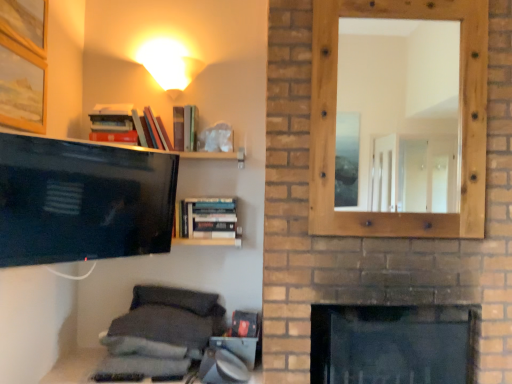
What do you see at coordinates (177, 299) in the screenshot? I see `dark gray fabric pillow at lower center, arranged as the first pillow when viewed from the top` at bounding box center [177, 299].

How much space does wooden picture frame at upper left, arranged as the second picture frame when ordered from the bottom, occupy vertically?

It is 11.12 inches.

The image size is (512, 384). What are the coordinates of `hardcover books at center` in the screenshot? It's located at (206, 218).

Describe the element at coordinates (169, 65) in the screenshot. I see `matte white cone at upper center` at that location.

The image size is (512, 384). Describe the element at coordinates (399, 113) in the screenshot. I see `wooden mirror at upper right` at that location.

Image resolution: width=512 pixels, height=384 pixels. What do you see at coordinates (391, 344) in the screenshot?
I see `smooth brick fireplace at lower right` at bounding box center [391, 344].

Identify the location of smooth brick fireplace at lower right. (391, 344).

This screenshot has width=512, height=384. In order to click on dark gray fabric pillow at lower center, arranged as the first pillow when viewed from the top in this screenshot , I will do `click(177, 299)`.

Would you say gray fabric pillow at lower center, which ranks as the second pillow in bottom-to-top order, is part of wooden mirror at upper right's contents?

That's incorrect, gray fabric pillow at lower center, which ranks as the second pillow in bottom-to-top order, is not inside wooden mirror at upper right.

Which point is more forward, (x=372, y=189) or (x=103, y=340)?

Positioned in front is point (x=103, y=340).

Can you confirm if wooden mirror at upper right is bigger than gray fabric pillow at lower center, which ranks as the second pillow in bottom-to-top order?

Indeed, wooden mirror at upper right has a larger size compared to gray fabric pillow at lower center, which ranks as the second pillow in bottom-to-top order.

Is wooden mirror at upper right taller or shorter than gray fabric pillow at lower center, the 2th pillow from the top?

Considering their sizes, wooden mirror at upper right has more height than gray fabric pillow at lower center, the 2th pillow from the top.

Is point (215, 309) more distant than point (139, 345)?

Yes, point (215, 309) is behind point (139, 345).

Between dark gray fabric pillow at lower center, arranged as the first pillow when viewed from the top, and gray fabric pillow at lower center, which ranks as the 1th pillow in bottom-to-top order, which one has smaller size?

Smaller between the two is dark gray fabric pillow at lower center, arranged as the first pillow when viewed from the top.

Which of these two, dark gray fabric pillow at lower center, arranged as the first pillow when viewed from the top, or gray fabric pillow at lower center, which ranks as the 1th pillow in bottom-to-top order, is thinner?

dark gray fabric pillow at lower center, arranged as the first pillow when viewed from the top.

Between dark gray fabric pillow at lower center, marked as the third pillow in a bottom-to-top arrangement, and gray fabric pillow at lower center, which appears as the third pillow when viewed from the top, which one appears on the left side from the viewer's perspective?

gray fabric pillow at lower center, which appears as the third pillow when viewed from the top.

Which point is more distant from viewer, [362,41] or [35,1]?

Point [362,41]

From the image's perspective, is wooden mirror at upper right located above or below wooden picture frame at upper left, arranged as the second picture frame when ordered from the bottom?

wooden mirror at upper right is below wooden picture frame at upper left, arranged as the second picture frame when ordered from the bottom.

Considering the relative sizes of wooden mirror at upper right and wooden picture frame at upper left, arranged as the second picture frame when ordered from the bottom, in the image provided, is wooden mirror at upper right thinner than wooden picture frame at upper left, arranged as the second picture frame when ordered from the bottom,?

No.

From a real-world perspective, which is physically above, wooden mirror at upper right or wooden picture frame at upper left, arranged as the second picture frame when ordered from the bottom?

wooden picture frame at upper left, arranged as the second picture frame when ordered from the bottom.

Relative to wooden picture frame at upper left, the 1th picture frame when ordered from bottom to top, is dark gray fabric pillow at lower center, marked as the third pillow in a bottom-to-top arrangement, in front or behind?

dark gray fabric pillow at lower center, marked as the third pillow in a bottom-to-top arrangement, is behind wooden picture frame at upper left, the 1th picture frame when ordered from bottom to top.

Between dark gray fabric pillow at lower center, marked as the third pillow in a bottom-to-top arrangement, and wooden picture frame at upper left, the 1th picture frame when ordered from bottom to top, which one has larger width?

Wider between the two is dark gray fabric pillow at lower center, marked as the third pillow in a bottom-to-top arrangement.

Which object is positioned more to the left, dark gray fabric pillow at lower center, arranged as the first pillow when viewed from the top, or wooden picture frame at upper left, the 1th picture frame when ordered from bottom to top?

wooden picture frame at upper left, the 1th picture frame when ordered from bottom to top.

Is point (200, 299) positioned behind point (3, 102)?

Yes, point (200, 299) is behind point (3, 102).

Is matte white cone at upper center situated inside gray fabric pillow at lower center, which ranks as the second pillow in bottom-to-top order, or outside?

matte white cone at upper center is not inside gray fabric pillow at lower center, which ranks as the second pillow in bottom-to-top order, it's outside.

Is matte white cone at upper center looking in the opposite direction of gray fabric pillow at lower center, the 2th pillow from the top?

That's not correct — matte white cone at upper center is not looking away from gray fabric pillow at lower center, the 2th pillow from the top.

Are matte white cone at upper center and gray fabric pillow at lower center, the 2th pillow from the top, far apart?

Yes, matte white cone at upper center and gray fabric pillow at lower center, the 2th pillow from the top, are located far from each other.

Which of these two, matte white cone at upper center or gray fabric pillow at lower center, the 2th pillow from the top, is wider?

gray fabric pillow at lower center, the 2th pillow from the top, is wider.

From a real-world perspective, relative to matte white cone at upper center, is wooden mirror at upper right vertically above or below?

From a real-world perspective, wooden mirror at upper right is physically below matte white cone at upper center.

The width and height of the screenshot is (512, 384). I want to click on mirror below the matte white cone at upper center (from the image's perspective), so click(399, 113).

Is the depth of wooden mirror at upper right greater than that of matte white cone at upper center?

No, it is in front of matte white cone at upper center.

Does point (360, 186) come closer to viewer compared to point (172, 61)?

No, it is not.

Which object is closer to the camera, dark gray fabric pillow at lower center, marked as the third pillow in a bottom-to-top arrangement, or wooden mirror at upper right?

wooden mirror at upper right.

Is dark gray fabric pillow at lower center, arranged as the first pillow when viewed from the top, smaller than wooden mirror at upper right?

Yes, dark gray fabric pillow at lower center, arranged as the first pillow when viewed from the top, is smaller than wooden mirror at upper right.

Would you consider dark gray fabric pillow at lower center, arranged as the first pillow when viewed from the top, to be distant from wooden mirror at upper right?

Yes, dark gray fabric pillow at lower center, arranged as the first pillow when viewed from the top, and wooden mirror at upper right are quite far apart.

Is dark gray fabric pillow at lower center, marked as the third pillow in a bottom-to-top arrangement, aimed at wooden mirror at upper right?

No, dark gray fabric pillow at lower center, marked as the third pillow in a bottom-to-top arrangement, does not turn towards wooden mirror at upper right.

Identify the location of mirror above the gray fabric pillow at lower center, which ranks as the second pillow in bottom-to-top order (from a real-world perspective). Image resolution: width=512 pixels, height=384 pixels. (399, 113).

Find the location of a particular element. The image size is (512, 384). the 2nd pillow directly beneath the dark gray fabric pillow at lower center, arranged as the first pillow when viewed from the top (from a real-world perspective) is located at coordinates tap(141, 347).

When comparing their distances from gray fabric pillow at lower center, which appears as the third pillow when viewed from the top, does smooth brick fireplace at lower right or hardcover books at center seem further?

smooth brick fireplace at lower right.

Based on their spatial positions, is matte white cone at upper center or wooden picture frame at upper left, the first picture frame when ordered from top to bottom, further from matte black tv at left?

matte white cone at upper center lies further to matte black tv at left than the other object.

Which object lies nearer to the anchor point wooden mirror at upper right, matte black tv at left or hardcover books at center?

hardcover books at center is closer to wooden mirror at upper right.

Consider the image. Considering their positions, is wooden mirror at upper right positioned closer to smooth brick fireplace at lower right than dark gray fabric pillow at lower center, marked as the third pillow in a bottom-to-top arrangement?

dark gray fabric pillow at lower center, marked as the third pillow in a bottom-to-top arrangement, lies closer to smooth brick fireplace at lower right than the other object.

Based on their spatial positions, is smooth brick fireplace at lower right or wooden mirror at upper right further from wooden picture frame at upper left, the 1th picture frame when ordered from bottom to top?

wooden mirror at upper right is positioned further to the anchor wooden picture frame at upper left, the 1th picture frame when ordered from bottom to top.

From the image, which object appears to be farther from gray fabric pillow at lower center, which ranks as the 1th pillow in bottom-to-top order, dark gray fabric pillow at lower center, marked as the third pillow in a bottom-to-top arrangement, or matte white cone at upper center?

The object further to gray fabric pillow at lower center, which ranks as the 1th pillow in bottom-to-top order, is matte white cone at upper center.

Which object lies nearer to the anchor point matte white cone at upper center, dark gray fabric pillow at lower center, marked as the third pillow in a bottom-to-top arrangement, or gray fabric pillow at lower center, which appears as the third pillow when viewed from the top?

Among the two, dark gray fabric pillow at lower center, marked as the third pillow in a bottom-to-top arrangement, is located nearer to matte white cone at upper center.

When comparing their distances from wooden picture frame at upper left, the first picture frame when ordered from top to bottom, does matte black tv at left or dark gray fabric pillow at lower center, marked as the third pillow in a bottom-to-top arrangement, seem further?

dark gray fabric pillow at lower center, marked as the third pillow in a bottom-to-top arrangement, lies further to wooden picture frame at upper left, the first picture frame when ordered from top to bottom, than the other object.

I want to click on picture frame between matte white cone at upper center and dark gray fabric pillow at lower center, marked as the third pillow in a bottom-to-top arrangement, in the vertical direction, so (22, 87).

In order to click on picture frame between wooden picture frame at upper left, arranged as the second picture frame when ordered from the bottom, and dark gray fabric pillow at lower center, arranged as the first pillow when viewed from the top, in the up-down direction in this screenshot , I will do `click(22, 87)`.

What are the coordinates of `book between matte black tv at left and matte white cone at upper center in the front-back direction` in the screenshot? It's located at (206, 218).

Identify the location of television that lies between matte white cone at upper center and smooth brick fireplace at lower right from top to bottom. The image size is (512, 384). (82, 201).